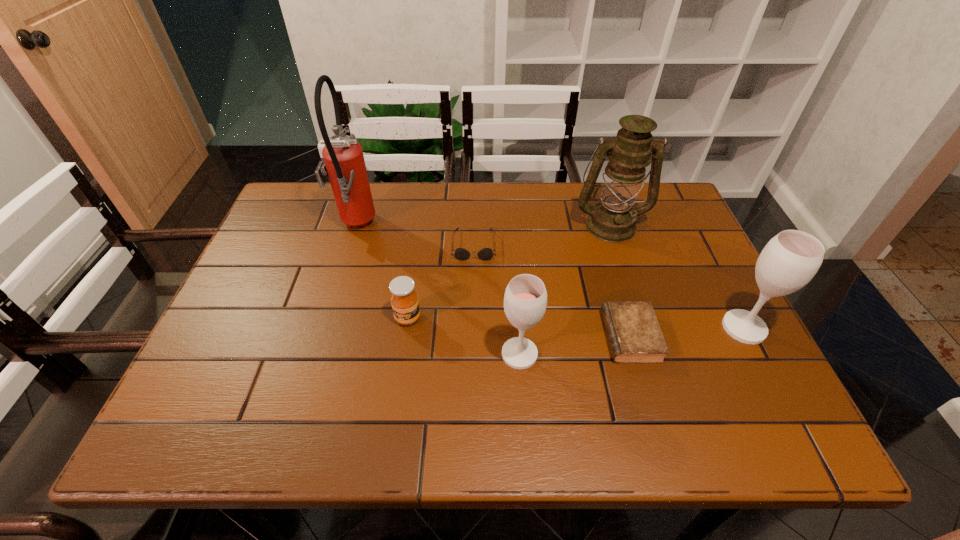
At what (x,y) coordinates should I click in order to perform the action: click on the shorter wineglass. Please return your answer as a coordinate pair (x, y). This screenshot has width=960, height=540. Looking at the image, I should click on (525, 300).

The image size is (960, 540). Find the location of `the fourth shortest object`. the fourth shortest object is located at coordinates (525, 300).

At what (x,y) coordinates should I click in order to perform the action: click on the third tallest object. Please return your answer as a coordinate pair (x, y). The height and width of the screenshot is (540, 960). Looking at the image, I should click on (788, 262).

The width and height of the screenshot is (960, 540). I want to click on the rightmost object, so [788, 262].

Where is `the leftmost object`? This screenshot has width=960, height=540. the leftmost object is located at coordinates (345, 166).

Locate an element on the screen. This screenshot has height=540, width=960. fire extinguisher is located at coordinates [345, 166].

At what (x,y) coordinates should I click in order to perform the action: click on sunglasses. Please return your answer as a coordinate pair (x, y). This screenshot has width=960, height=540. Looking at the image, I should click on (462, 254).

This screenshot has width=960, height=540. Find the location of `the second tallest object`. the second tallest object is located at coordinates (613, 219).

The image size is (960, 540). Identify the location of the sixth object from right to left. (405, 304).

Identify the location of honey. This screenshot has width=960, height=540. (405, 304).